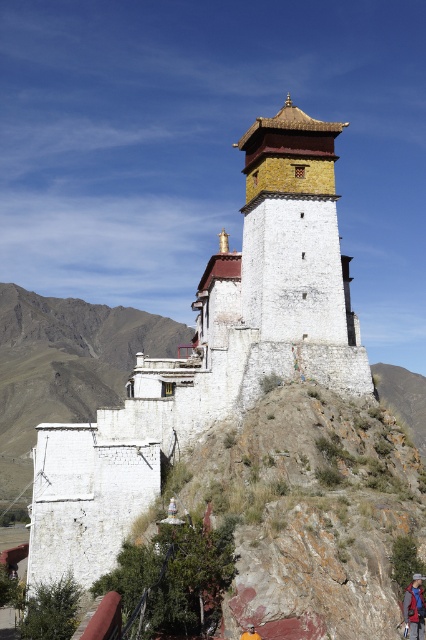
Question: Considering the real-world distances, which object is farthest from the blue fabric backpack at center?

Choices:
 (A) white stone temple at center
 (B) brown leather hat at center

Answer: (A)

Question: Does white stone temple at center appear on the left side of brown leather hat at center?

Choices:
 (A) no
 (B) yes

Answer: (B)

Question: Which point is closer to the camera taking this photo?

Choices:
 (A) (40, 582)
 (B) (244, 637)
 (C) (420, 627)

Answer: (B)

Question: Can you confirm if blue fabric backpack at center is positioned to the right of brown leather hat at center?

Choices:
 (A) no
 (B) yes

Answer: (B)

Question: Based on their relative distances, which object is farther from the brown leather hat at center?

Choices:
 (A) white stone temple at center
 (B) blue fabric backpack at center

Answer: (A)

Question: Does white stone temple at center appear on the left side of blue fabric backpack at center?

Choices:
 (A) no
 (B) yes

Answer: (B)